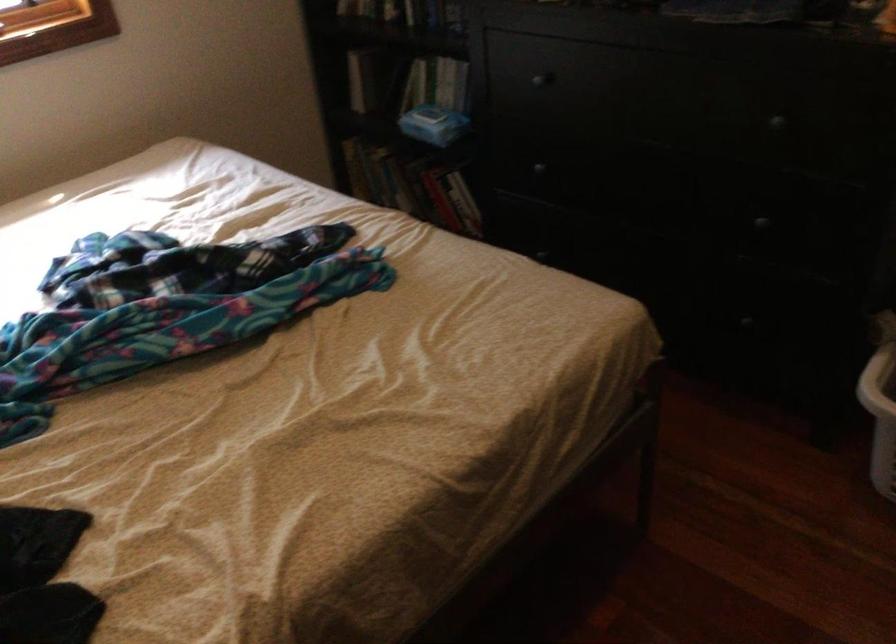
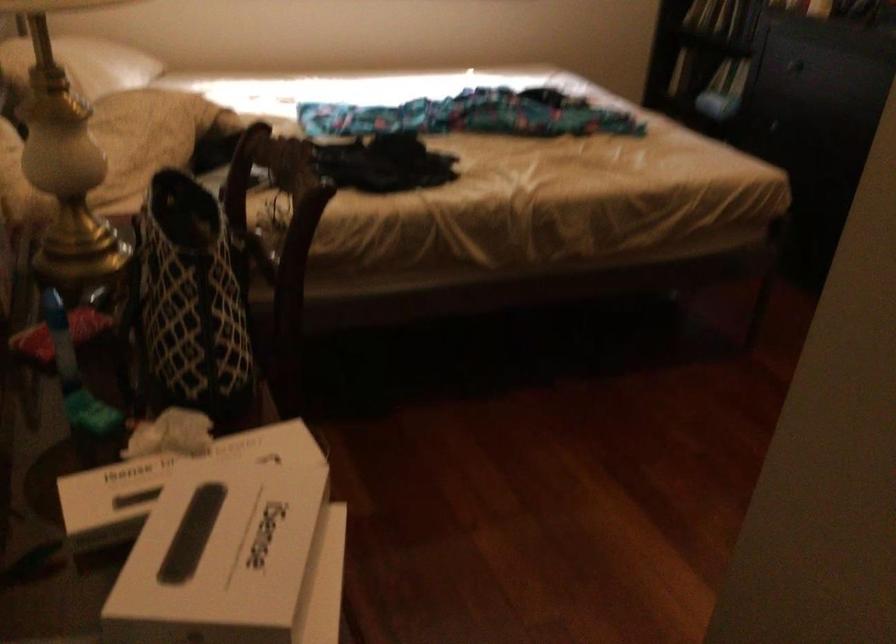
Question: I am providing you with two images of the same scene from different viewpoints. After the viewpoint changes to image2, which objects are now occluded?

Choices:
 (A) white product box
 (B) book
 (C) pink throw pillow
 (D) patterned tote bag

Answer: (B)